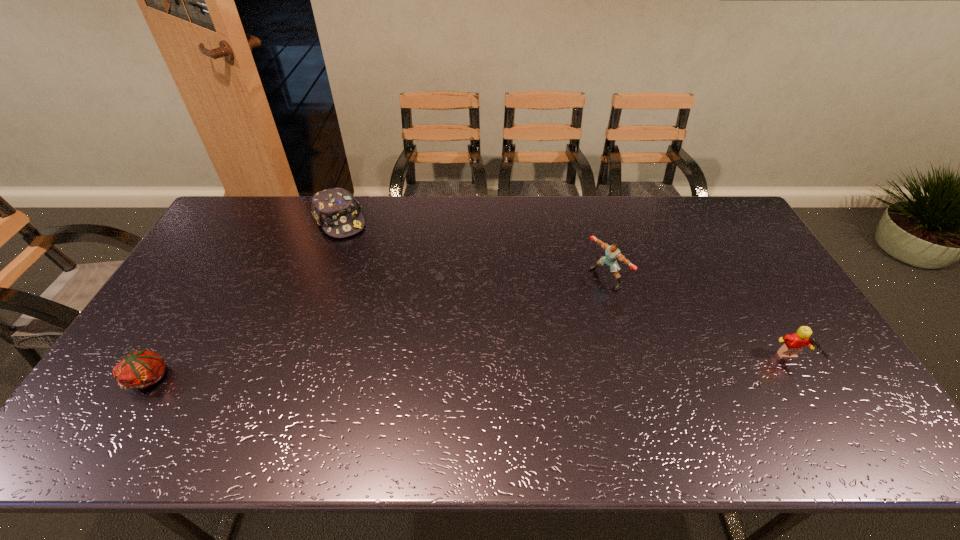
Identify the location of vacant space located on the front-facing side of the farthest object. (378, 275).

Find the location of `vacant space located on the front-facing side of the farthest object`. vacant space located on the front-facing side of the farthest object is located at coordinates (380, 279).

Where is `vacant space located 0.330m on the front-facing side of the farthest object`? vacant space located 0.330m on the front-facing side of the farthest object is located at coordinates (392, 295).

The image size is (960, 540). I want to click on object at the far edge, so click(336, 210).

Find the location of a particular element. This screenshot has height=540, width=960. tomato that is at the near edge is located at coordinates (140, 369).

Where is `Lego located at the near edge`? This screenshot has width=960, height=540. Lego located at the near edge is located at coordinates (793, 344).

What are the coordinates of `object situated at the left edge` in the screenshot? It's located at (140, 369).

Locate an element on the screen. Image resolution: width=960 pixels, height=540 pixels. object that is at the right edge is located at coordinates (793, 344).

Locate an element on the screen. The image size is (960, 540). object that is at the near left corner is located at coordinates (140, 369).

Where is `object located at the near right corner`? The height and width of the screenshot is (540, 960). object located at the near right corner is located at coordinates (793, 344).